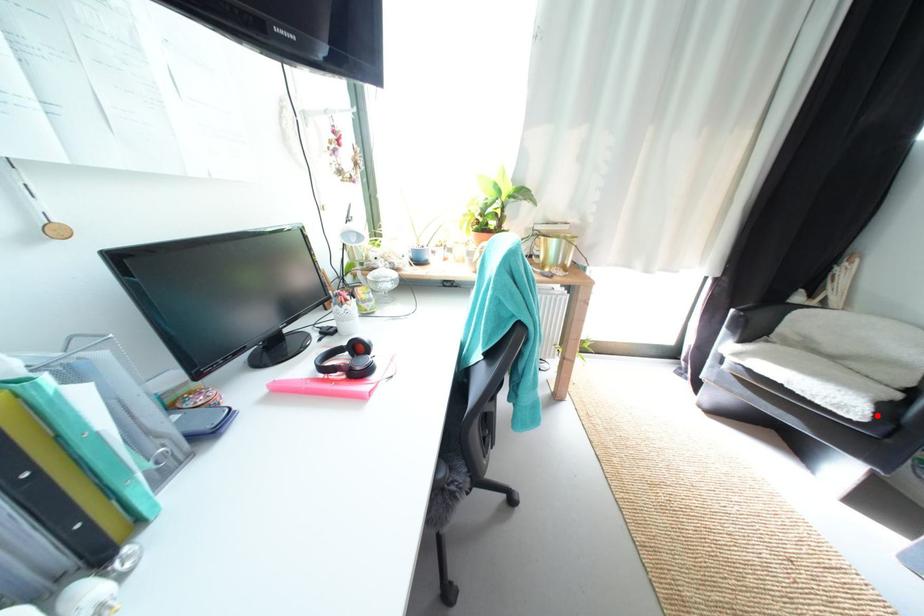
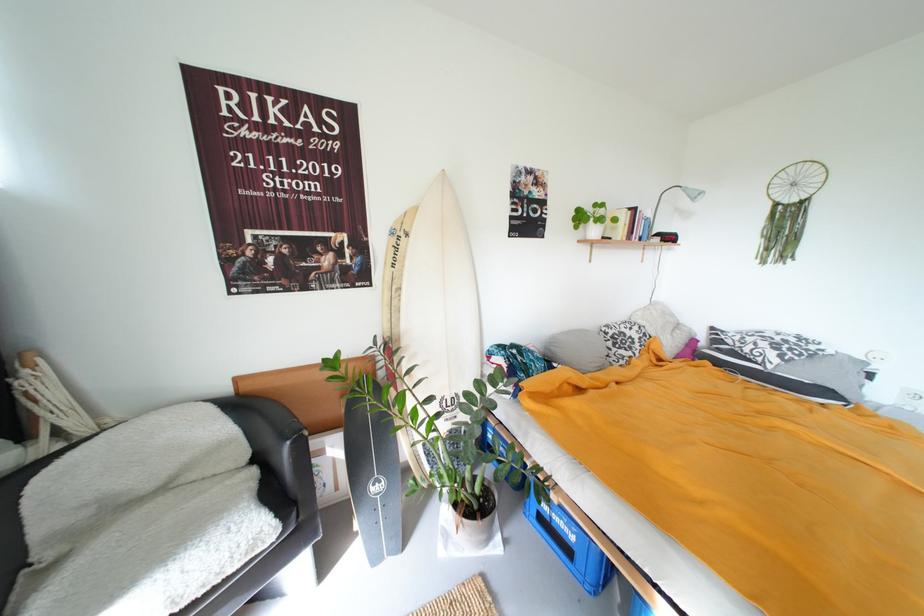
In the second image, find the point that corresponds to the highlighted location in the first image.

(284, 524)